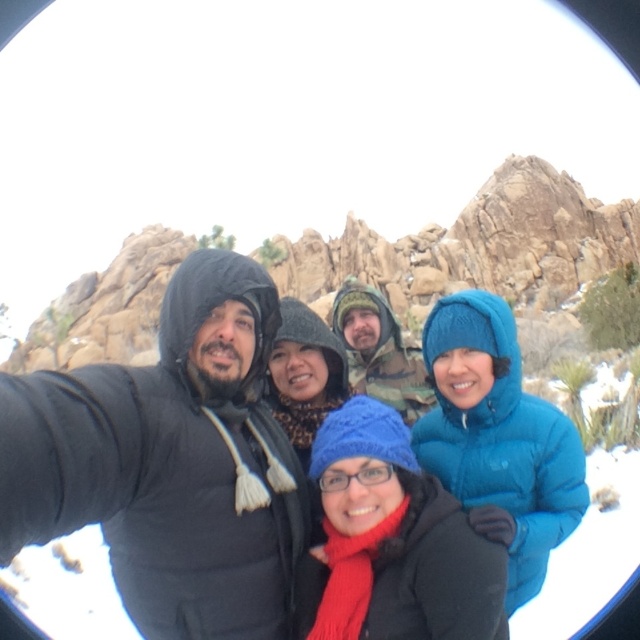
You are trying to locate the matte black jacket at center in the image. According to the coordinates provided, where should you look?

The matte black jacket at center is located at point 0.727 on the x axis and 0.267 on the y axis.

You are planning to take a photo with two items from the scene. You have a matte black jacket at center and a knitted blue hat at center. If you want to place them side by side on a shelf, which one should you adjust the shelf width for first?

The matte black jacket at center might be wider than knitted blue hat at center, so you should adjust the shelf width for the matte black jacket at center first to ensure it fits properly.